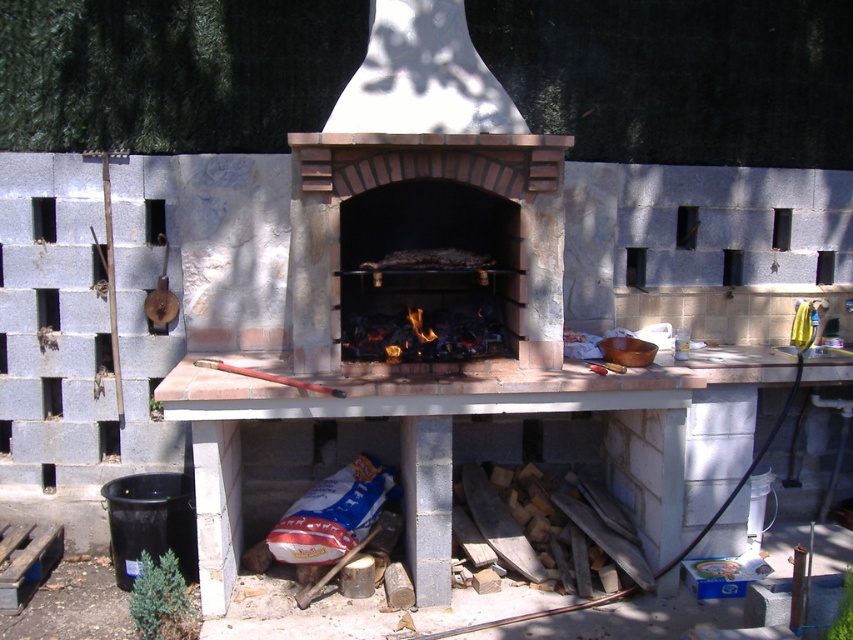
Question: Can you confirm if brick oven at center is smaller than charcoal briquettes at center?

Choices:
 (A) no
 (B) yes

Answer: (A)

Question: Is brick oven at center bigger than charcoal briquettes at center?

Choices:
 (A) yes
 (B) no

Answer: (A)

Question: Is brick oven at center wider than charcoal briquettes at center?

Choices:
 (A) no
 (B) yes

Answer: (B)